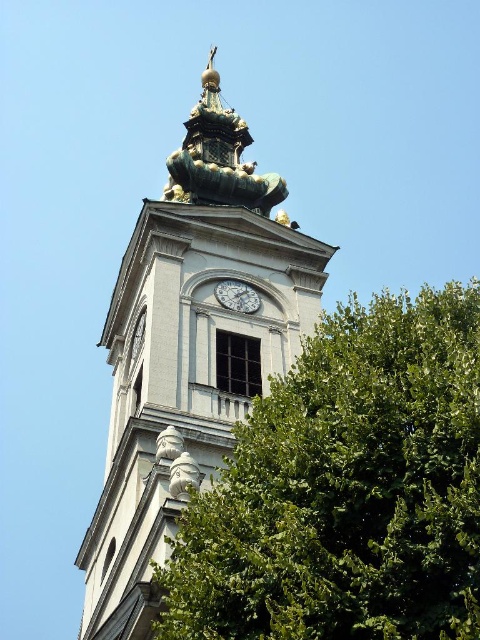
Question: Is the position of green leafy tree at center less distant than that of silver metallic clock at center?

Choices:
 (A) no
 (B) yes

Answer: (B)

Question: Which point appears closest to the camera in this image?

Choices:
 (A) (288, 252)
 (B) (244, 292)
 (C) (249, 474)

Answer: (C)

Question: Does green leafy tree at center appear over white stone clock tower at center?

Choices:
 (A) yes
 (B) no

Answer: (B)

Question: Does green leafy tree at center have a smaller size compared to white stone clock tower at center?

Choices:
 (A) no
 (B) yes

Answer: (B)

Question: Estimate the real-world distances between objects in this image. Which object is closer to the green leafy tree at center?

Choices:
 (A) white stone clock tower at center
 (B) silver metallic clock at center

Answer: (A)

Question: Among these objects, which one is farthest from the camera?

Choices:
 (A) green leafy tree at center
 (B) white stone clock tower at center
 (C) silver metallic clock at center

Answer: (C)